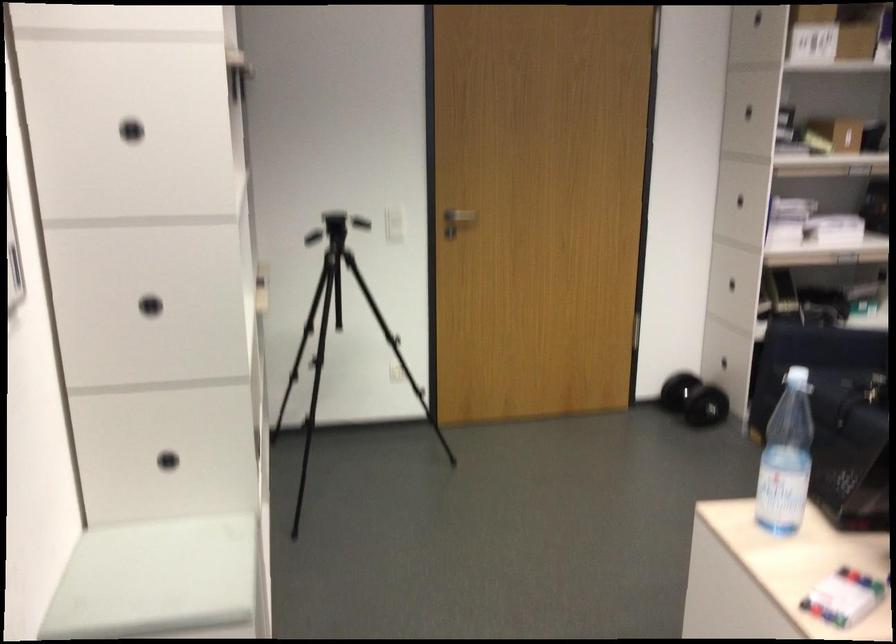
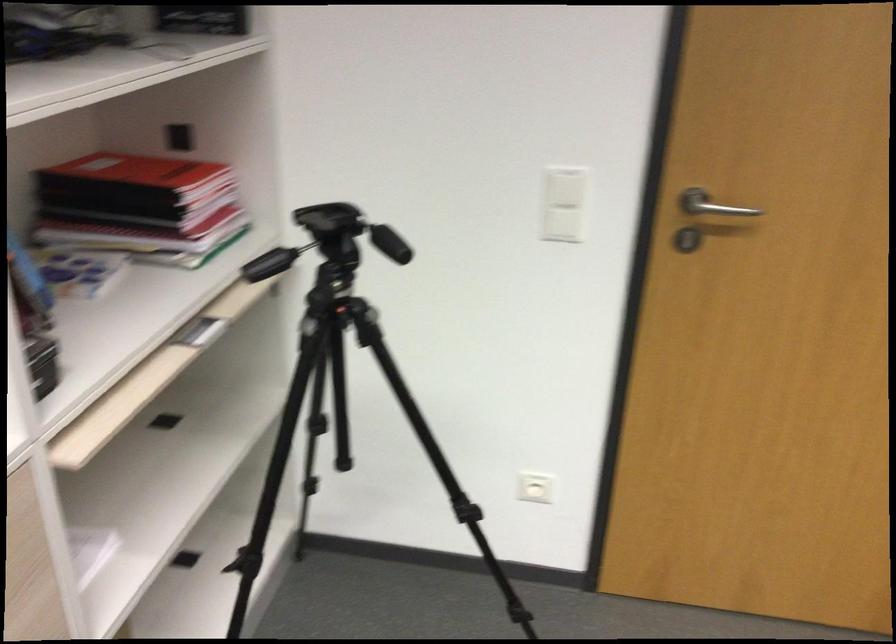
In the second image, find the point that corresponds to point (372, 230) in the first image.

(563, 225)